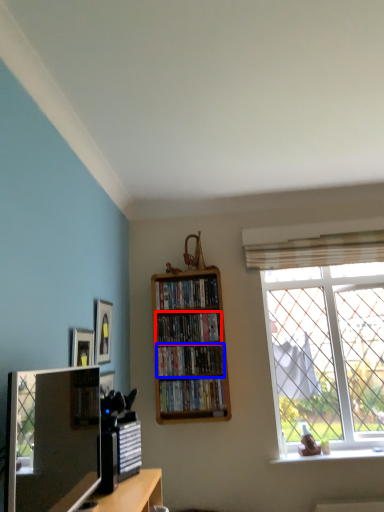
Question: Which object is further to the camera taking this photo, book (highlighted by a red box) or book (highlighted by a blue box)?

Choices:
 (A) book
 (B) book

Answer: (A)